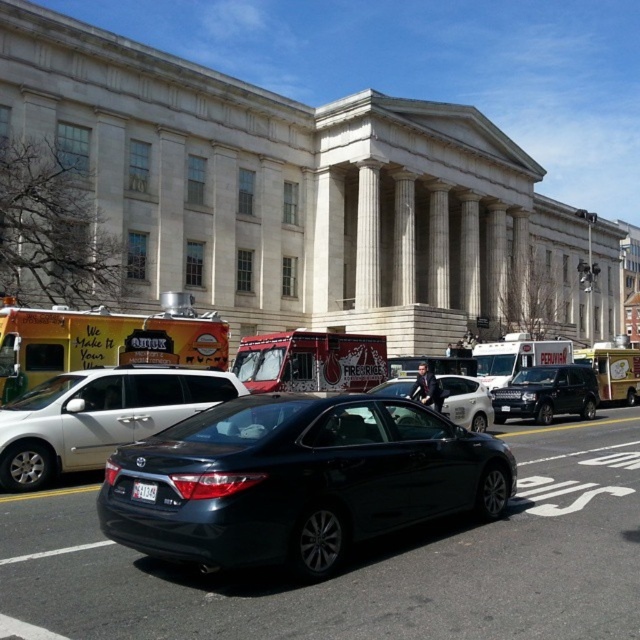
You are a pedestrian standing on the sidewalk in front of the classical building. You see the yellow matte food truck at lower left and the white plastic license plate at center. Which object is closer to the ground?

The white plastic license plate at center is closer to the ground because the yellow matte food truck at lower left is above it.

Based on the photo, you are a pedestrian standing on the sidewalk in front of the classical building. You want to buy a snack from one of the food trucks. Which food truck, the yellow matte food truck at lower left or the white cardboard food truck at right, is easier to reach without crossing the road?

The yellow matte food truck at lower left is closer to the viewer than the white cardboard food truck at right, so it is easier to reach without crossing the road.